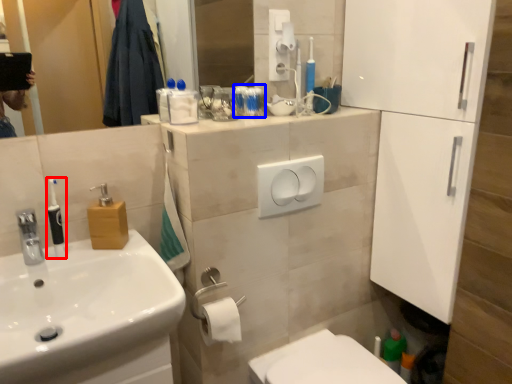
Question: Which object is closer to the camera taking this photo, toiletry (highlighted by a red box) or toiletry (highlighted by a blue box)?

Choices:
 (A) toiletry
 (B) toiletry

Answer: (A)